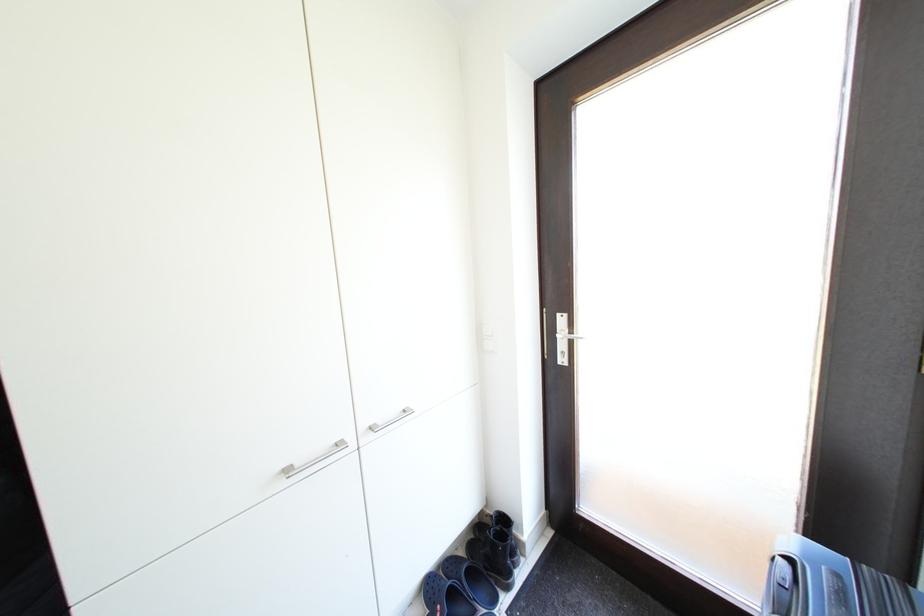
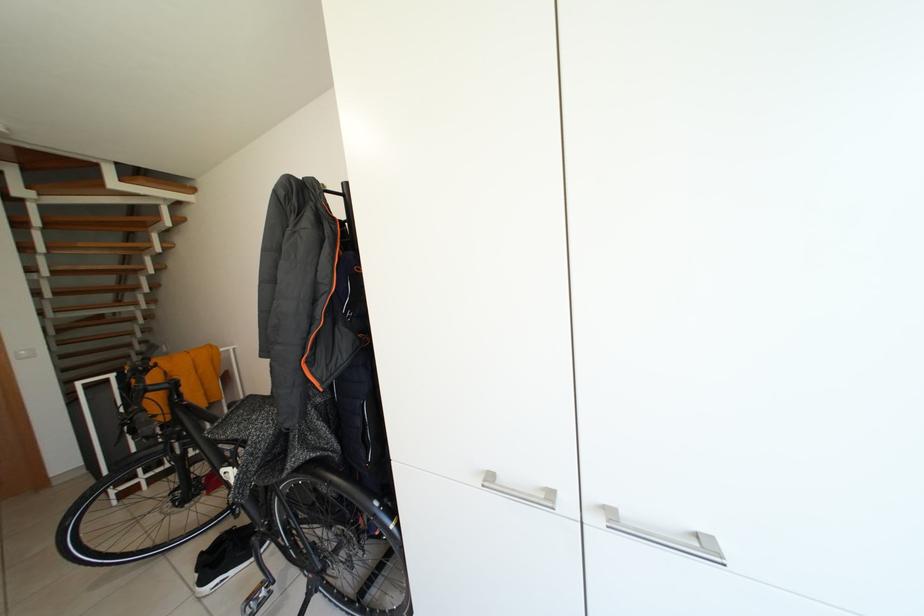
Question: The first image is from the beginning of the video and the second image is from the end. How did the camera likely rotate when shooting the video?

Choices:
 (A) Left
 (B) Right
 (C) Up
 (D) Down

Answer: (A)